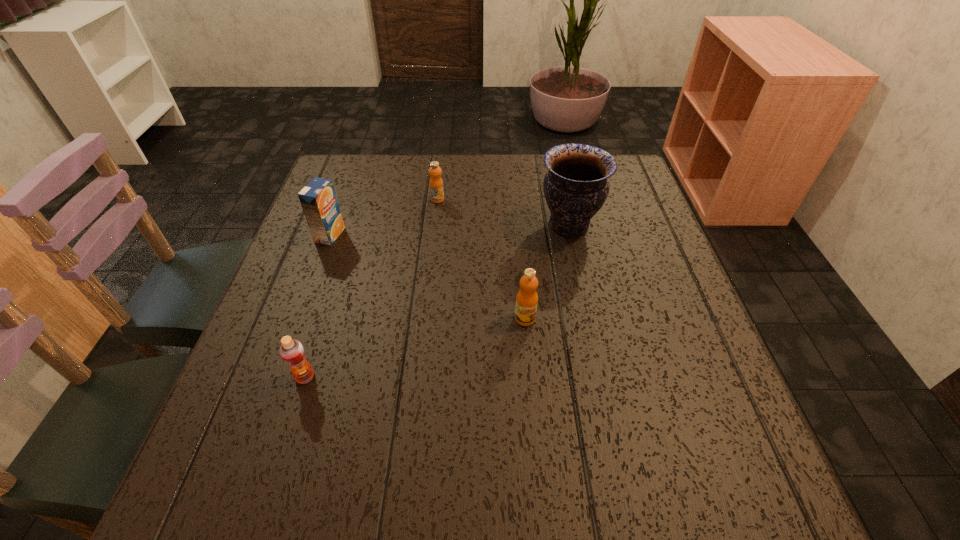
Identify the location of pottery. click(576, 186).

This screenshot has width=960, height=540. Find the location of `the rightmost object`. the rightmost object is located at coordinates (576, 186).

Image resolution: width=960 pixels, height=540 pixels. In order to click on the second farthest orange juice in this screenshot , I will do `click(318, 199)`.

The image size is (960, 540). I want to click on the rightmost orange juice, so click(x=527, y=298).

At what (x,y) coordinates should I click in order to perform the action: click on the third farthest orange juice. Please return your answer as a coordinate pair (x, y). Image resolution: width=960 pixels, height=540 pixels. Looking at the image, I should click on click(527, 298).

This screenshot has height=540, width=960. Find the location of `the nearest object`. the nearest object is located at coordinates (292, 352).

The width and height of the screenshot is (960, 540). I want to click on the third object from left to right, so click(436, 184).

Where is `the farthest orange juice`? the farthest orange juice is located at coordinates (436, 184).

The image size is (960, 540). Find the location of `vacant position located on the front handle of the pottery`. vacant position located on the front handle of the pottery is located at coordinates (396, 225).

Where is `free region located 0.200m on the front handle of the pottery`? The width and height of the screenshot is (960, 540). free region located 0.200m on the front handle of the pottery is located at coordinates (458, 225).